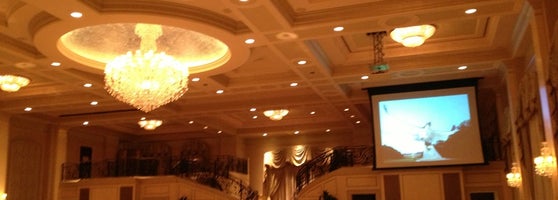
Locate an element on the screen. The width and height of the screenshot is (558, 200). chandelier is located at coordinates (169, 82).